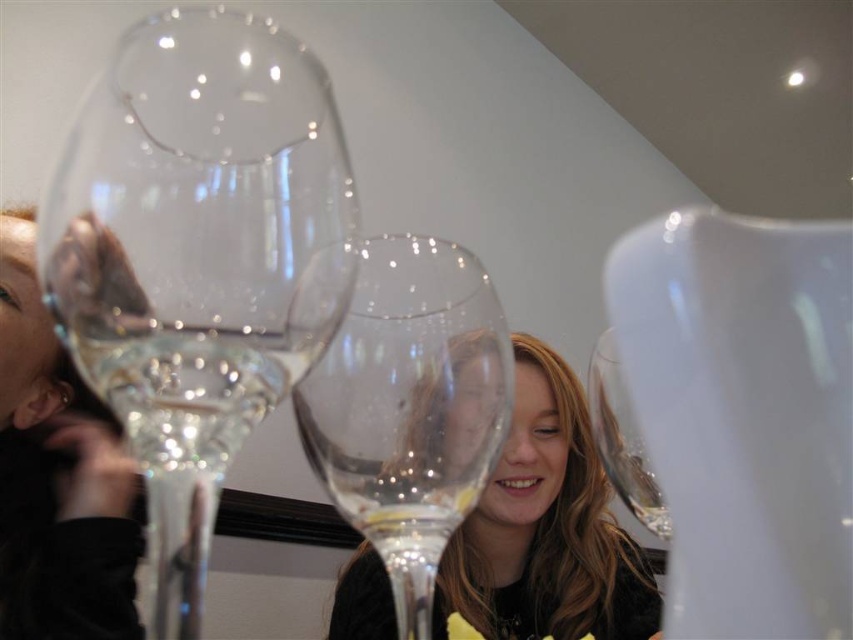
Who is positioned more to the right, transparent glass wine glass at left or matte glass wine glass at center?

From the viewer's perspective, matte glass wine glass at center appears more on the right side.

Can you confirm if transparent glass wine glass at left is thinner than matte glass wine glass at center?

Yes.

Who is more forward, [93,195] or [508,589]?

Positioned in front is point [93,195].

Find the location of a particular element. This screenshot has height=640, width=853. transparent glass wine glass at left is located at coordinates (198, 257).

Based on the photo, does transparent glass wine glass at center appear over matte glass wine glass at center?

Indeed, transparent glass wine glass at center is positioned over matte glass wine glass at center.

Who is lower down, transparent glass wine glass at center or matte glass wine glass at center?

Positioned lower is matte glass wine glass at center.

Locate an element on the screen. transparent glass wine glass at center is located at coordinates (409, 406).

Between point (518, 541) and point (193, 422), which one is positioned behind?

Point (518, 541)

Is matte glass wine glass at center wider than clear glass wine at center?

Indeed, matte glass wine glass at center has a greater width compared to clear glass wine at center.

Is point (395, 632) closer to viewer compared to point (142, 365)?

That is False.

At what (x,y) coordinates should I click in order to perform the action: click on matte glass wine glass at center. Please return your answer as a coordinate pair (x, y). Looking at the image, I should click on (546, 528).